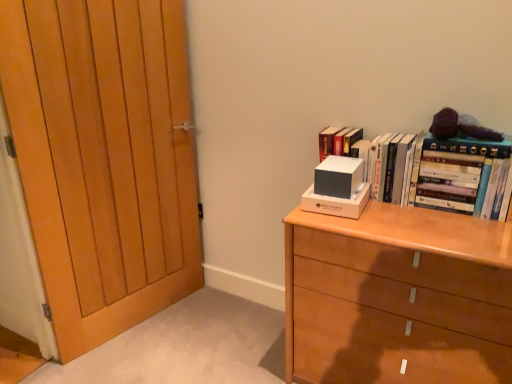
Locate an element on the screen. This screenshot has height=384, width=512. vacant space to the right of wooden door at left is located at coordinates (210, 328).